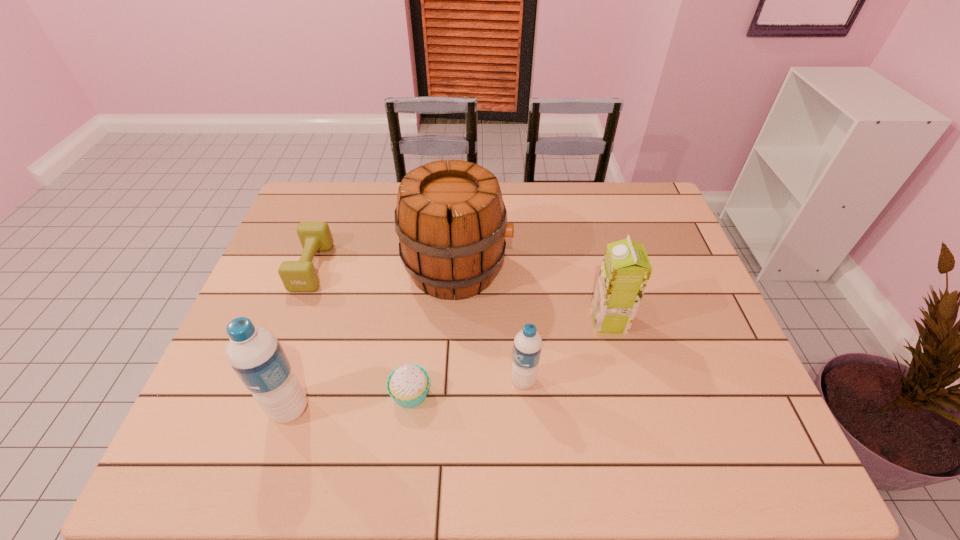
The image size is (960, 540). Find the location of `free point between the third farthest object and the cupcake`. free point between the third farthest object and the cupcake is located at coordinates (510, 357).

The height and width of the screenshot is (540, 960). Identify the location of empty location between the cupcake and the cider. (434, 331).

This screenshot has height=540, width=960. Identify the location of vacant space in between the left water bottle and the dumbbell. (300, 338).

This screenshot has height=540, width=960. Find the location of `vacant area that lies between the shorter water bottle and the cupcake`. vacant area that lies between the shorter water bottle and the cupcake is located at coordinates (467, 387).

Locate an element on the screen. Image resolution: width=960 pixels, height=540 pixels. object identified as the second closest to the cupcake is located at coordinates (527, 347).

Identify the location of object that stands as the fifth closest to the cider. (255, 354).

The height and width of the screenshot is (540, 960). What are the coordinates of `free space that satisfies the following two spatial constraints: 1. on the front side of the cupcake; 2. on the label of the taller water bottle` in the screenshot? It's located at pyautogui.click(x=409, y=409).

Identify the location of vacant space that satisfies the following two spatial constraints: 1. on the label of the right water bottle; 2. on the front side of the cupcake. 524,394.